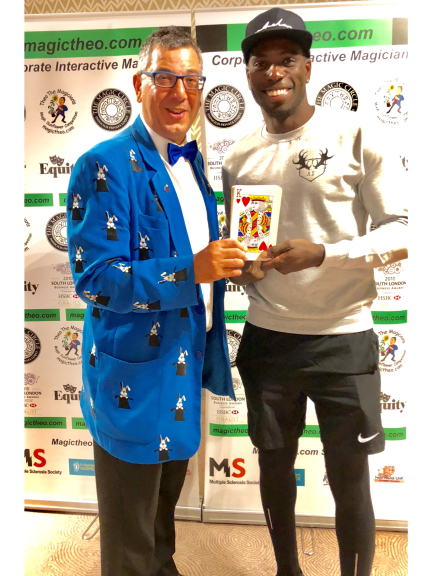
I want to click on floor, so click(x=219, y=544).